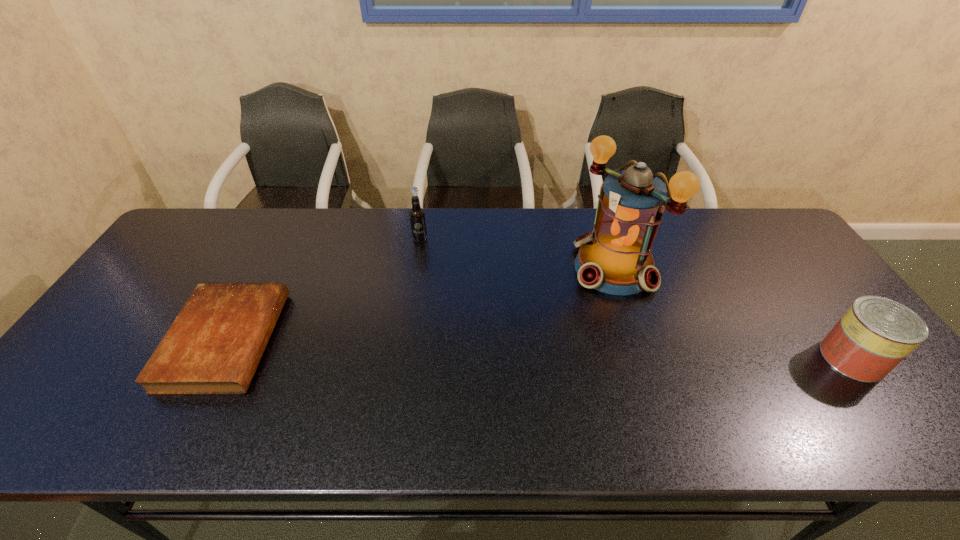
Locate an element on the screen. This screenshot has height=540, width=960. the leftmost object is located at coordinates (213, 347).

This screenshot has height=540, width=960. I want to click on Bible, so click(213, 347).

The image size is (960, 540). I want to click on the rightmost object, so click(x=875, y=334).

Locate an element on the screen. The image size is (960, 540). can is located at coordinates (875, 334).

I want to click on the second object from right to left, so click(615, 258).

In order to click on the tallest object in this screenshot , I will do `click(615, 258)`.

I want to click on the second object from left to right, so click(x=417, y=216).

Find the location of a particular element. The image size is (960, 540). root beer is located at coordinates (417, 216).

Locate an element on the screen. The image size is (960, 540). vacant space located 0.390m on the spine side of the shortest object is located at coordinates (425, 340).

In order to click on vacant space located on the back of the rightmost object in this screenshot , I will do `click(808, 299)`.